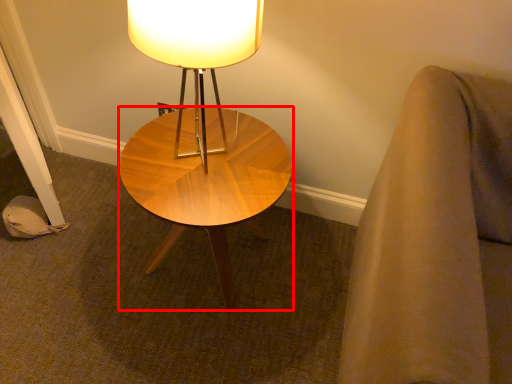
Question: From the image's perspective, what is the correct spatial relationship of coffee table (annotated by the red box) in relation to lamp?

Choices:
 (A) above
 (B) below

Answer: (B)